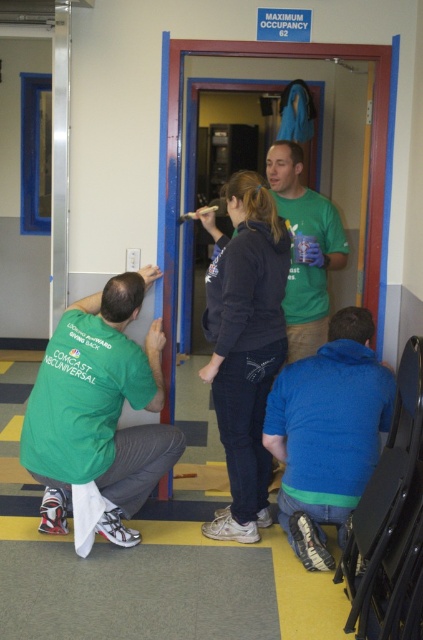
You are a photographer trying to capture a candid shot of the dark gray hoodie at center and the blue fleece jacket at lower right. Since you want to ensure both subjects are in focus, you need to know their vertical positions. Which one is higher up in the frame?

The dark gray hoodie at center is above blue fleece jacket at lower right, so it is higher up in the frame.

You are organizing a group photo and need to arrange the dark gray hoodie at center and the blue fleece jacket at lower right in a row from left to right. Based on their current positions in the scene, which order should they be placed in?

The dark gray hoodie at center should be placed to the left of the blue fleece jacket at lower right since it is positioned on the left side of the blue fleece jacket at lower right in the scene.

You are a painter who needs to pass between the green matte shirt at lower left and the blue fleece jacket at lower right to reach the paint supplies. Can you walk through the space between them without moving either person?

The green matte shirt at lower left and blue fleece jacket at lower right are 87.75 centimeters apart from each other. Since the average person requires about 60 centimeters of space to pass comfortably, the 87.75 cm gap should allow you to walk through the space between them without needing to move either person.